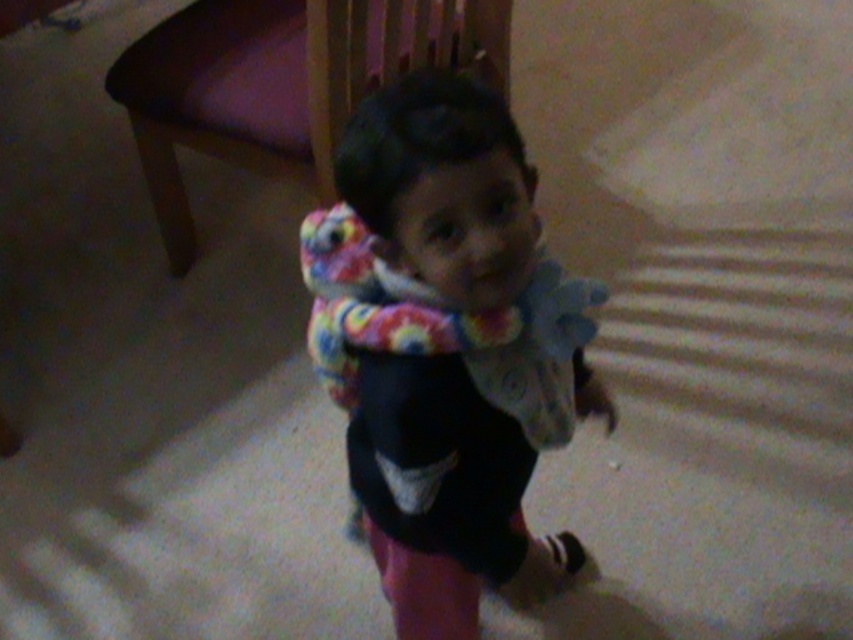
You are a photographer setting up a shot in this room. You need to place a small prop between the two points, point (544, 384) and point (167, 157). To ensure the prop is visible in the foreground, where should you position it relative to the two points?

To ensure the prop is visible in the foreground, position it closer to point (544, 384) since it is closer to the viewer than point (167, 157).

You are a parent trying to place a fluffy multicolored scarf at center on a wooden chair at upper left. Can you fit the scarf on the chair without it falling off, considering their positions?

The wooden chair at upper left and fluffy multicolored scarf at center are 24.28 inches apart from each other. Since the distance between them is significant, placing the scarf on the chair might require moving closer. However, the question is about fitting without falling off, which depends on the chair size. The description doesn

You are a parent trying to decide if your child can sit comfortably on the wooden chair at upper left while holding the fluffy multicolored scarf at center. Based on their sizes, is the chair tall enough for the child to sit without the scarf slipping off the chair?

The wooden chair at upper left is taller than the fluffy multicolored scarf at center. Since the chair is taller, the scarf would not slip off when placed on it, allowing the child to sit comfortably.